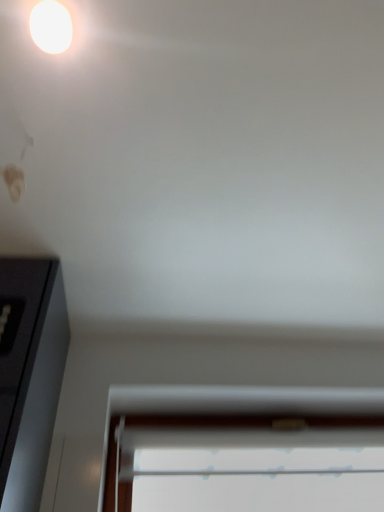
Question: Should I look upward or downward to see white plastic window at lower center?

Choices:
 (A) up
 (B) down

Answer: (B)